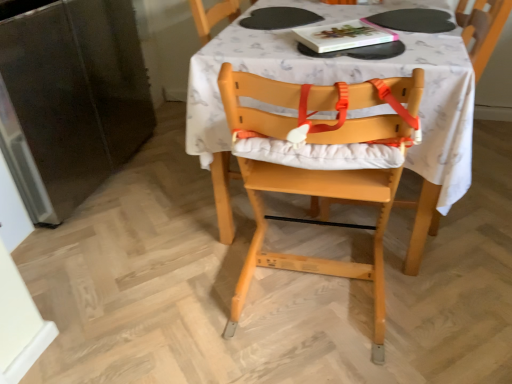
Where is `free location in front of natural wood highchair at center`? free location in front of natural wood highchair at center is located at coordinates (335, 357).